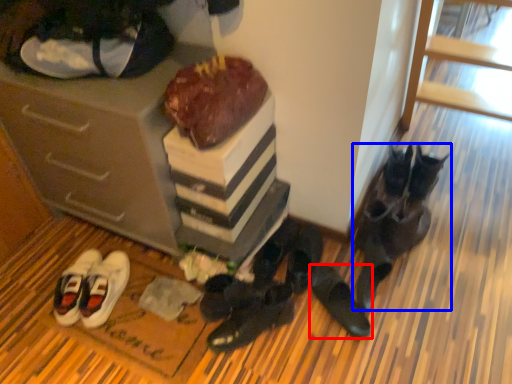
Question: Which of the following is the farthest to the observer, footwear (highlighted by a red box) or footwear (highlighted by a blue box)?

Choices:
 (A) footwear
 (B) footwear

Answer: (B)